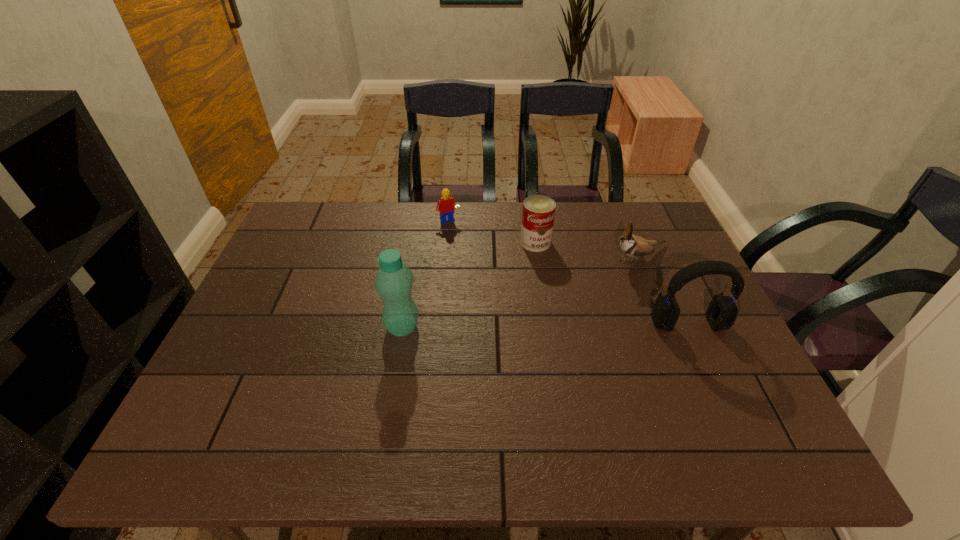
Locate an element on the screen. vacant space at the far right corner is located at coordinates (620, 205).

The height and width of the screenshot is (540, 960). What are the coordinates of `free space between the shortest object and the fourth shortest object` in the screenshot? It's located at (568, 273).

Locate an element on the screen. This screenshot has width=960, height=540. free point between the leftmost object and the can is located at coordinates (468, 285).

At what (x,y) coordinates should I click in order to perform the action: click on vacant area that lies between the bird and the bottle. Please return your answer as a coordinate pair (x, y). Looking at the image, I should click on (520, 293).

I want to click on vacant space in between the bottle and the headset, so click(545, 326).

In order to click on unoccupied area between the headset and the bird in this screenshot , I will do (663, 291).

This screenshot has height=540, width=960. What are the coordinates of `vacant area that lies between the bottle and the headset` in the screenshot? It's located at (545, 326).

You are a GUI agent. You are given a task and a screenshot of the screen. Output one action in this format:
    pyautogui.click(x=<x>, y=<y>)
    Task: Click on the free space between the leftmost object and the second tallest object
    The height and width of the screenshot is (540, 960).
    Given the screenshot: What is the action you would take?
    pyautogui.click(x=545, y=326)

Image resolution: width=960 pixels, height=540 pixels. Find the location of `free space between the fourth shortest object and the third object from left to right`. free space between the fourth shortest object and the third object from left to right is located at coordinates (612, 283).

Where is `free area in between the third object from right to left and the shortest object`? This screenshot has height=540, width=960. free area in between the third object from right to left and the shortest object is located at coordinates (492, 232).